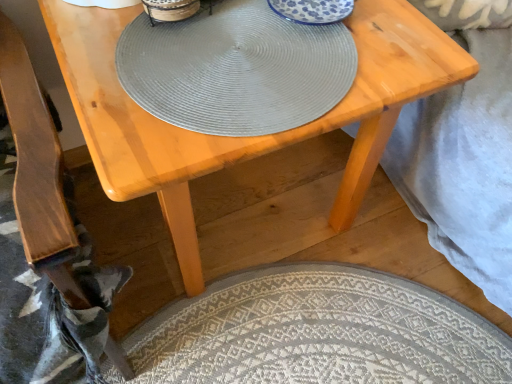
Identify the location of vacant area on top of light wood table at center (from a real-world perspective). The width and height of the screenshot is (512, 384). (264, 49).